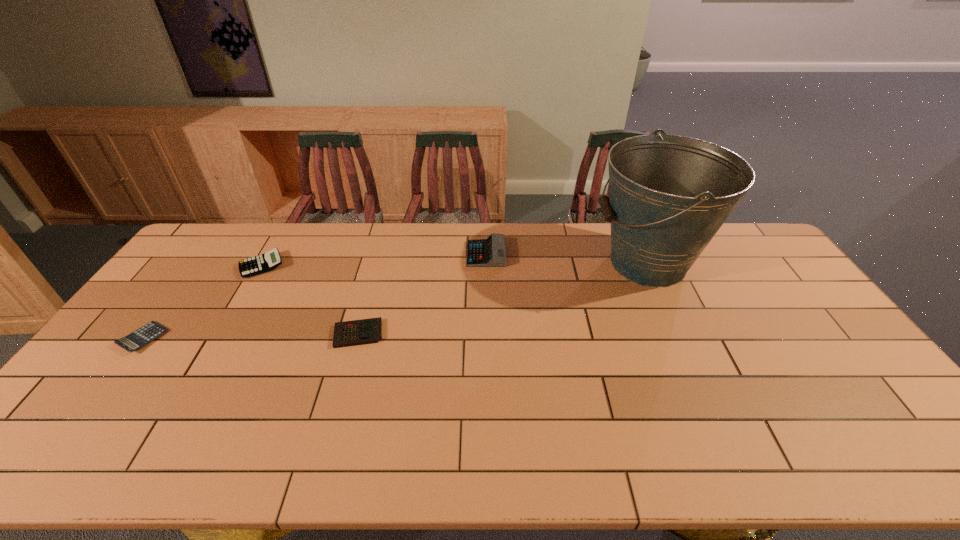
Where is `vacant area that lies between the shortest object and the tallest object`? Image resolution: width=960 pixels, height=540 pixels. vacant area that lies between the shortest object and the tallest object is located at coordinates (396, 301).

Where is `blank region between the second calculator from right to left and the fourth object from left to right`? blank region between the second calculator from right to left and the fourth object from left to right is located at coordinates (421, 294).

Image resolution: width=960 pixels, height=540 pixels. In order to click on vacant space that's between the fourth shortest object and the tallest object in this screenshot , I will do `click(566, 259)`.

Identify which object is the third nearest to the leftmost calculator. Please provide its 2D coordinates. Your answer should be formatted as a tuple, i.e. [(x, y)], where the tuple contains the x and y coordinates of a point satisfying the conditions above.

[(491, 252)]

Find the location of `the fourth closest object relative to the leftmost calculator`. the fourth closest object relative to the leftmost calculator is located at coordinates (669, 195).

Select which calculator appears as the third closest to the second shortest calculator. Please provide its 2D coordinates. Your answer should be formatted as a tuple, i.e. [(x, y)], where the tuple contains the x and y coordinates of a point satisfying the conditions above.

[(141, 337)]

Identify the location of the closest calculator to the leftmost object. (270, 260).

Locate an element on the screen. free space that satisfies the following two spatial constraints: 1. with the handle on opposite sides of the tallest object; 2. on the front side of the second shortest object is located at coordinates (680, 334).

At what (x,y) coordinates should I click in order to perform the action: click on vacant region that satisfies the following two spatial constraints: 1. on the back side of the fourth object from right to left; 2. on the right side of the rightmost calculator. Please return your answer as a coordinate pair (x, y). This screenshot has height=540, width=960. Looking at the image, I should click on [x=269, y=254].